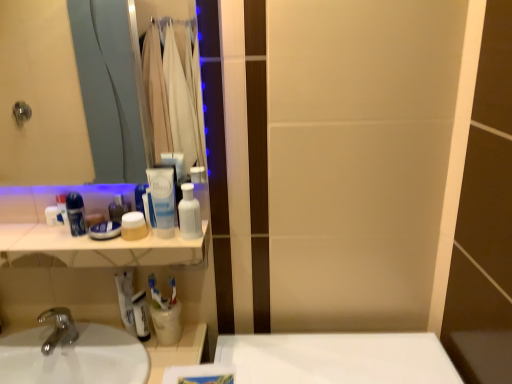
At what (x,y) coordinates should I click in order to perform the action: click on vacant area that is in front of white matte toothpaste at lower left. Please return your answer as a coordinate pair (x, y). Looking at the image, I should click on (128, 354).